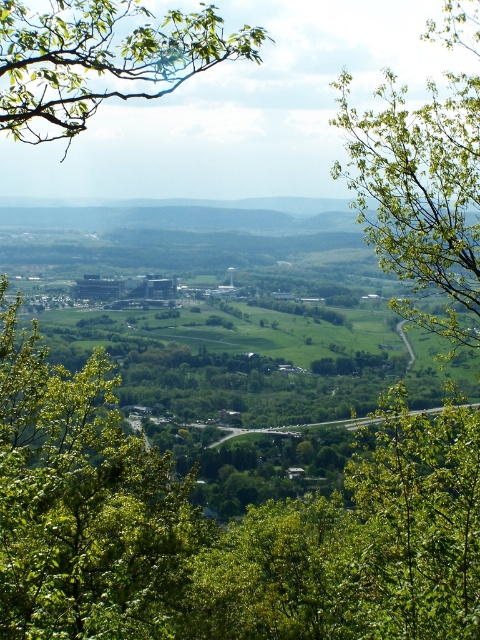
Question: Does green leafy tree at center have a greater width compared to green leafy tree at upper right?

Choices:
 (A) yes
 (B) no

Answer: (A)

Question: Which object appears farthest from the camera in this image?

Choices:
 (A) green leafy tree at center
 (B) green leafy tree at upper right

Answer: (B)

Question: Which object appears closest to the camera in this image?

Choices:
 (A) green leafy branch at upper left
 (B) green leafy tree at upper right
 (C) green leafy tree at center

Answer: (A)

Question: Can you confirm if green leafy tree at center is positioned above green leafy branch at upper left?

Choices:
 (A) yes
 (B) no

Answer: (B)

Question: Which object appears closest to the camera in this image?

Choices:
 (A) green leafy branch at upper left
 (B) green leafy tree at upper right
 (C) green leafy tree at center

Answer: (A)

Question: Can you confirm if green leafy tree at upper right is positioned to the right of green leafy branch at upper left?

Choices:
 (A) yes
 (B) no

Answer: (A)